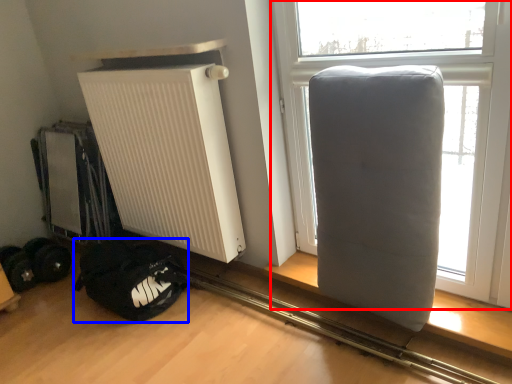
Question: Which of the following is the closest to the observer, window (highlighted by a red box) or sleeping bag (highlighted by a blue box)?

Choices:
 (A) window
 (B) sleeping bag

Answer: (A)